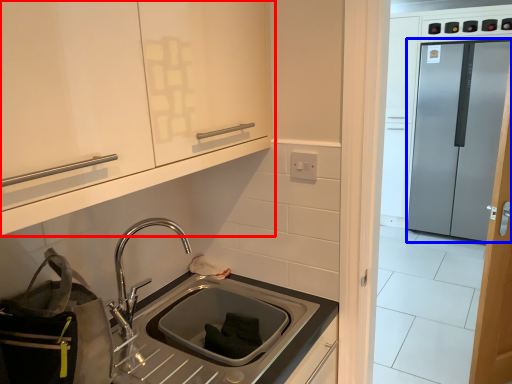
Question: Which point is further to the camera, cabinetry (highlighted by a red box) or glass door (highlighted by a blue box)?

Choices:
 (A) cabinetry
 (B) glass door

Answer: (B)